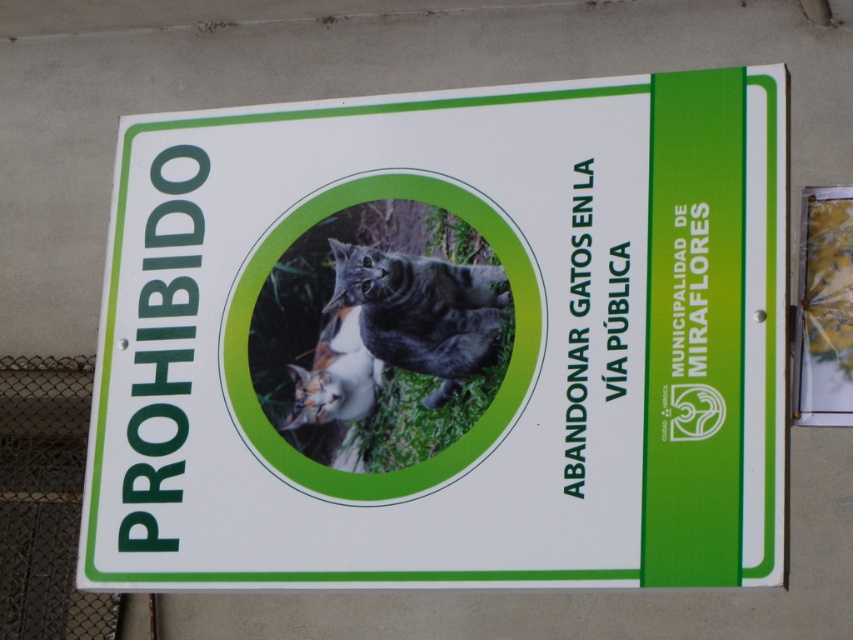
You are looking at the signboard and notice two points marked on it. The first point is at coordinates point (361, 211) and the second is at point (44, 620). Which point is closer to you?

Point (361, 211) is closer to the viewer than point (44, 620).